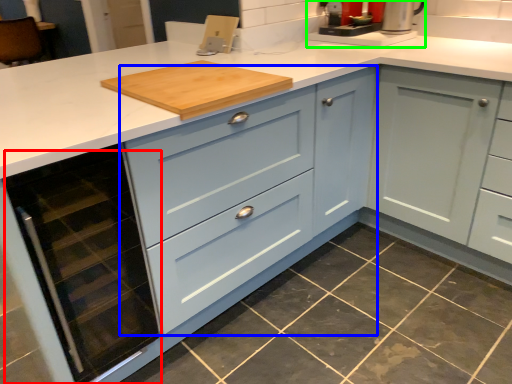
Question: Which is farther away from oven (highlighted by a red box)? cabinetry (highlighted by a blue box) or coffee machine (highlighted by a green box)?

Choices:
 (A) cabinetry
 (B) coffee machine

Answer: (B)